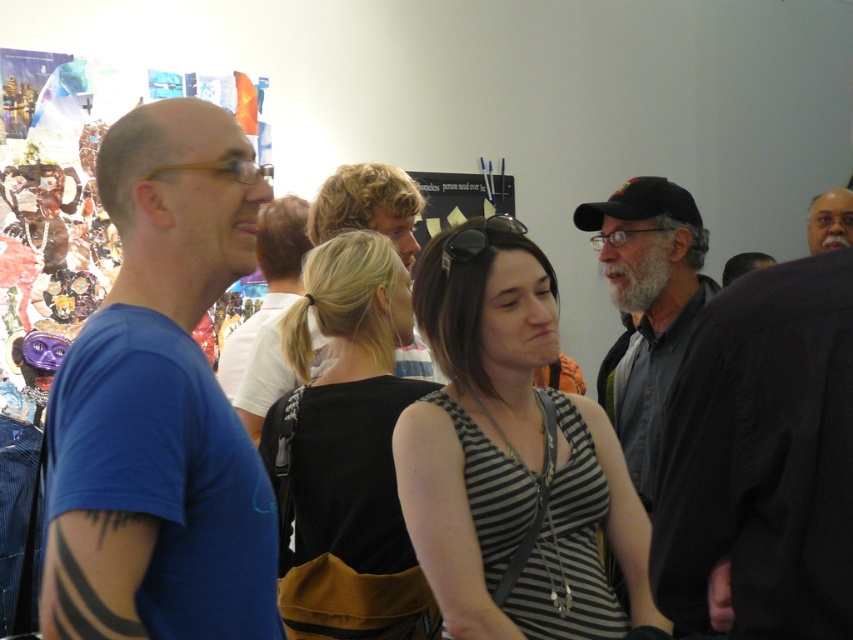
You are organizing a photo shoot and need to place a small decorative item between the black fabric at center and the gray hair at upper right. Considering their sizes, which object should the item be closer to?

The black fabric at center has a larger size compared to gray hair at upper right, so the decorative item should be placed closer to the gray hair at upper right to balance their sizes.

You are taking a photo of the scene and want to focus on both point (666, 292) and point (808, 236). Which point should you adjust your focus to first to ensure both are clear?

You should focus on point (666, 292) first because it is closer to the camera than point (808, 236), allowing both to be in focus when using depth of field.